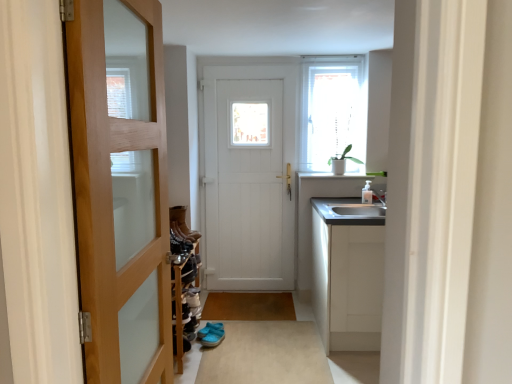
Question: Is leather boots at center situated inside wooden door at left, placed as the first door when sorted from front to back, or outside?

Choices:
 (A) outside
 (B) inside

Answer: (A)

Question: In terms of height, does leather boots at center look taller or shorter compared to wooden door at left, acting as the 2th door starting from the back?

Choices:
 (A) short
 (B) tall

Answer: (A)

Question: Estimate the real-world distances between objects in this image. Which object is farther from the beige carpet at center, the 2th plain viewed from the top?

Choices:
 (A) leather boots at center
 (B) blue fabric sandals at center
 (C) satin white cabinet at right
 (D) white wooden door at center, which appears as the first door when viewed from the back
 (E) translucent glass window at upper right

Answer: (E)

Question: Considering the real-world distances, which object is farthest from the blue fabric sandals at center?

Choices:
 (A) wooden door at left, placed as the first door when sorted from front to back
 (B) beige carpet at center, which is the 1th plain in front-to-back order
 (C) satin white cabinet at right
 (D) leather boots at center
 (E) brown matte mat at center, the 1th plain viewed from the top

Answer: (A)